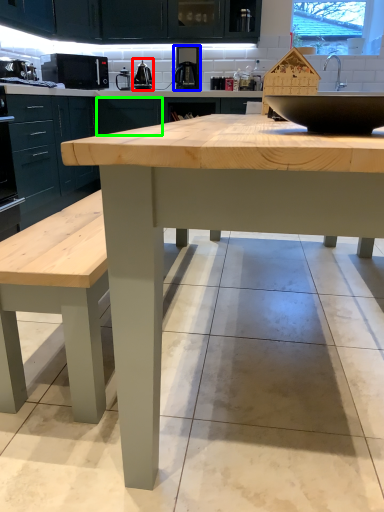
Question: Considering the real-world distances, which object is farthest from appliance (highlighted by a red box)? coffee machine (highlighted by a blue box) or cabinetry (highlighted by a green box)?

Choices:
 (A) coffee machine
 (B) cabinetry

Answer: (A)